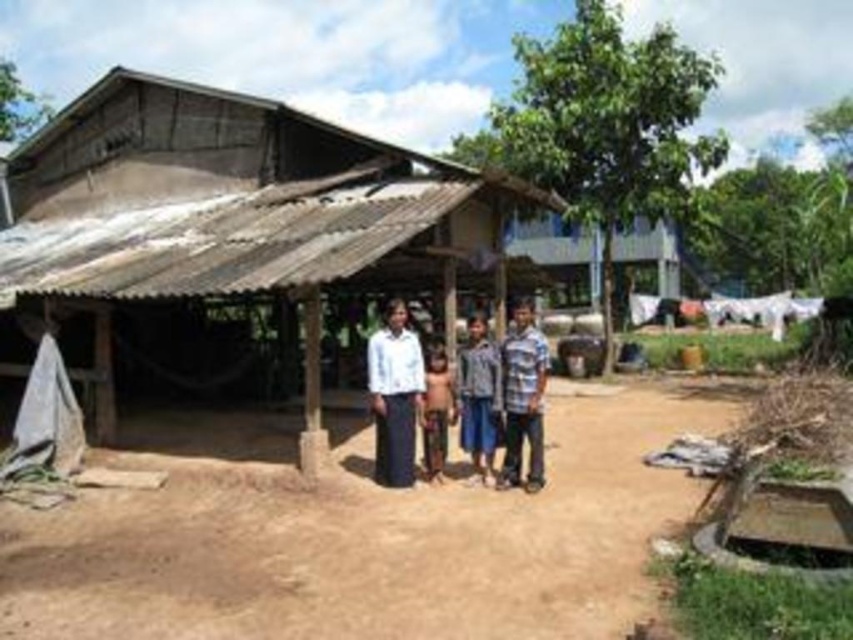
Can you confirm if white cotton shirt at center is shorter than brown fabric at center?

No.

Between point (376, 452) and point (442, 360), which one is positioned behind?

The point (442, 360) is behind.

Locate an element on the screen. This screenshot has width=853, height=640. white cotton shirt at center is located at coordinates (479, 397).

Does white matte shirt at center have a greater width compared to blue plaid shirt at center?

No, white matte shirt at center is not wider than blue plaid shirt at center.

Is white matte shirt at center above blue plaid shirt at center?

Yes, white matte shirt at center is above blue plaid shirt at center.

Is point (392, 385) positioned after point (506, 404)?

Yes, it is.

The width and height of the screenshot is (853, 640). Identify the location of white matte shirt at center. (393, 394).

Is blue plaid shirt at center below brown fabric at center?

Actually, blue plaid shirt at center is above brown fabric at center.

Which is below, blue plaid shirt at center or brown fabric at center?

Positioned lower is brown fabric at center.

Find the location of a particular element. This screenshot has width=853, height=640. blue plaid shirt at center is located at coordinates (523, 397).